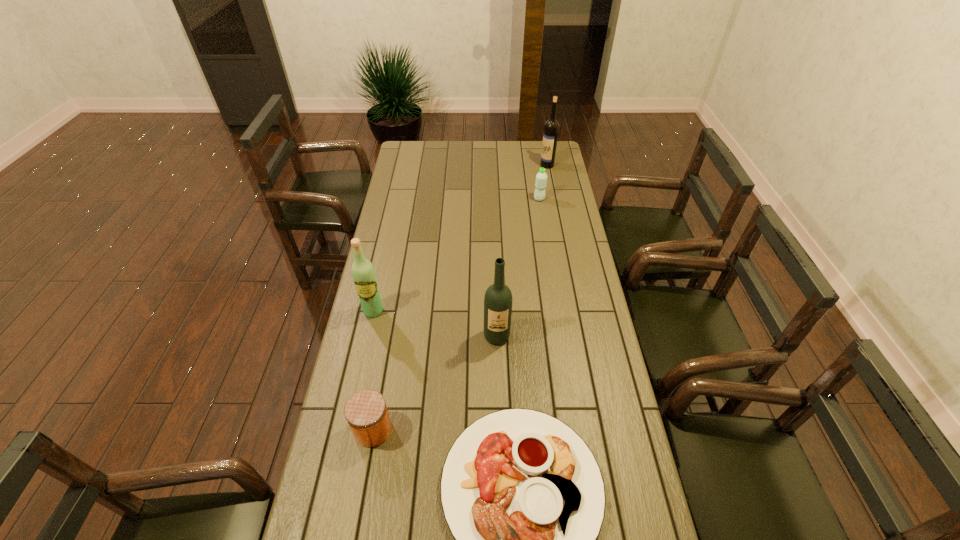
This screenshot has width=960, height=540. In order to click on the farthest object in this screenshot , I will do `click(551, 128)`.

Find the location of `the rightmost wine bottle`. the rightmost wine bottle is located at coordinates (551, 128).

The image size is (960, 540). I want to click on the nearest wine bottle, so click(x=498, y=298).

Find the location of a particular element. the third nearest object is located at coordinates (498, 298).

Find the location of a particular element. Image resolution: width=960 pixels, height=540 pixels. the leftmost wine bottle is located at coordinates (363, 273).

Find the location of a particular element. This screenshot has height=540, width=960. the fourth nearest object is located at coordinates (363, 273).

The height and width of the screenshot is (540, 960). In order to click on water bottle in this screenshot , I will do `click(541, 178)`.

This screenshot has width=960, height=540. In order to click on the fifth nearest object in this screenshot , I will do `click(541, 178)`.

At what (x,y) coordinates should I click in order to perform the action: click on jar. Please return your answer as a coordinate pair (x, y). The height and width of the screenshot is (540, 960). Looking at the image, I should click on (366, 412).

What are the coordinates of `vacant space located on the label of the rightmost wine bottle` in the screenshot? It's located at (505, 165).